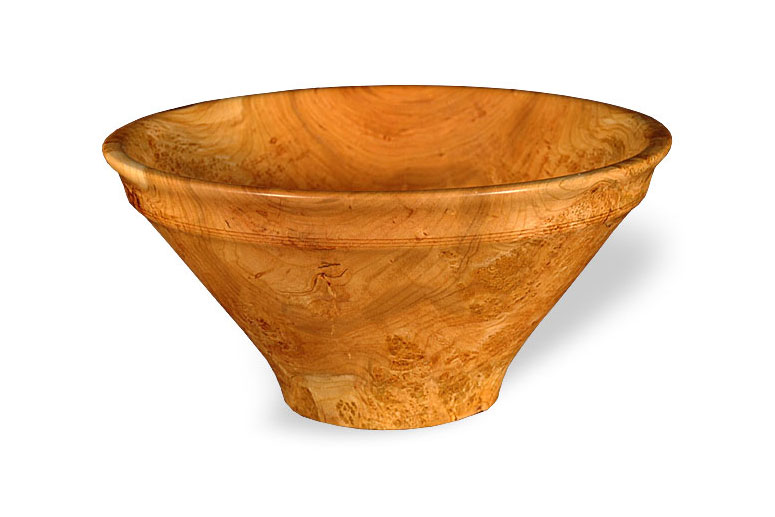
Image resolution: width=775 pixels, height=517 pixels. Find the location of `bowl`. bowl is located at coordinates (466, 299).